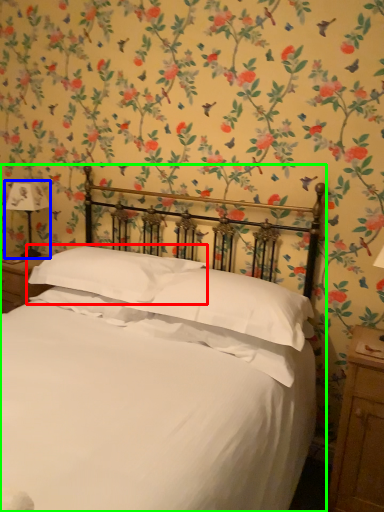
Question: Which object is positioned closest to pillow (highlighted by a red box)? Select from bedside lamp (highlighted by a blue box) and bed (highlighted by a green box).

Choices:
 (A) bedside lamp
 (B) bed

Answer: (B)